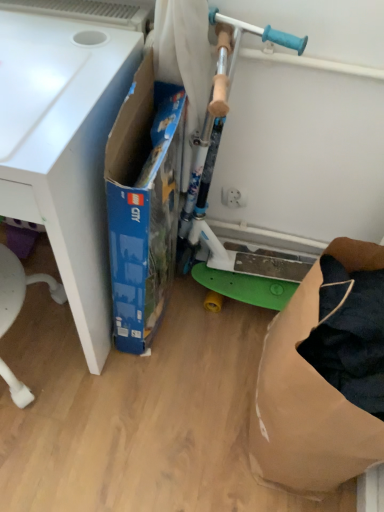
Locate an element on the screen. free space that is in between brown paper bag at lower right and green plastic scooter at center is located at coordinates (218, 361).